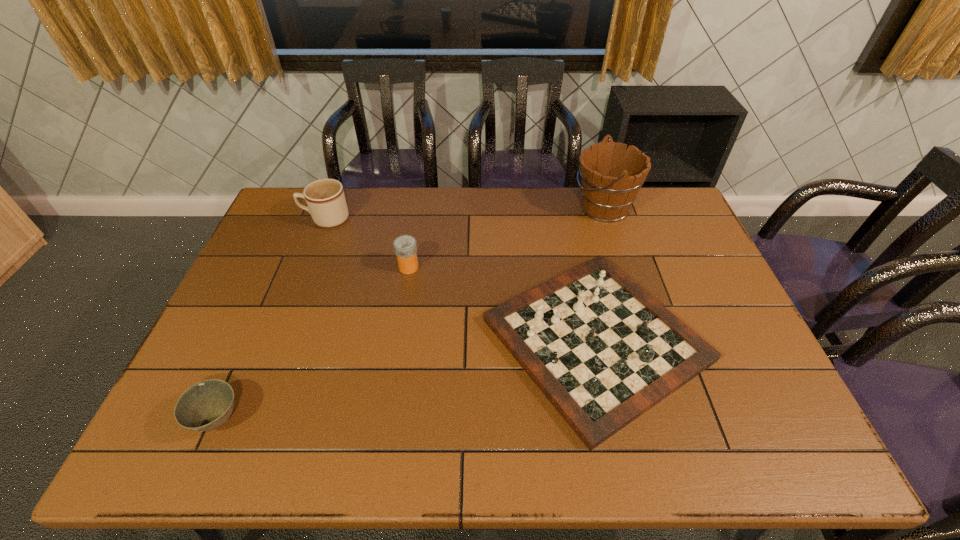
In order to click on free space located 0.260m on the left of the chessboard in this screenshot , I will do `click(388, 340)`.

Where is `free point located on the right of the bowl`? free point located on the right of the bowl is located at coordinates (351, 419).

Where is `wine bucket positioned at the far edge`? This screenshot has height=540, width=960. wine bucket positioned at the far edge is located at coordinates (611, 178).

Where is `mug located at the far edge`? The height and width of the screenshot is (540, 960). mug located at the far edge is located at coordinates (325, 198).

In order to click on chessboard situated at the near edge in this screenshot , I will do (603, 351).

This screenshot has height=540, width=960. I want to click on bowl located at the near edge, so click(x=206, y=405).

Locate an element on the screen. The image size is (960, 540). mug that is at the left edge is located at coordinates (325, 198).

The width and height of the screenshot is (960, 540). I want to click on bowl that is positioned at the left edge, so click(x=206, y=405).

Where is `wine bucket present at the right edge`? wine bucket present at the right edge is located at coordinates (611, 178).

This screenshot has width=960, height=540. Find the location of `chessboard that is at the right edge`. chessboard that is at the right edge is located at coordinates (603, 351).